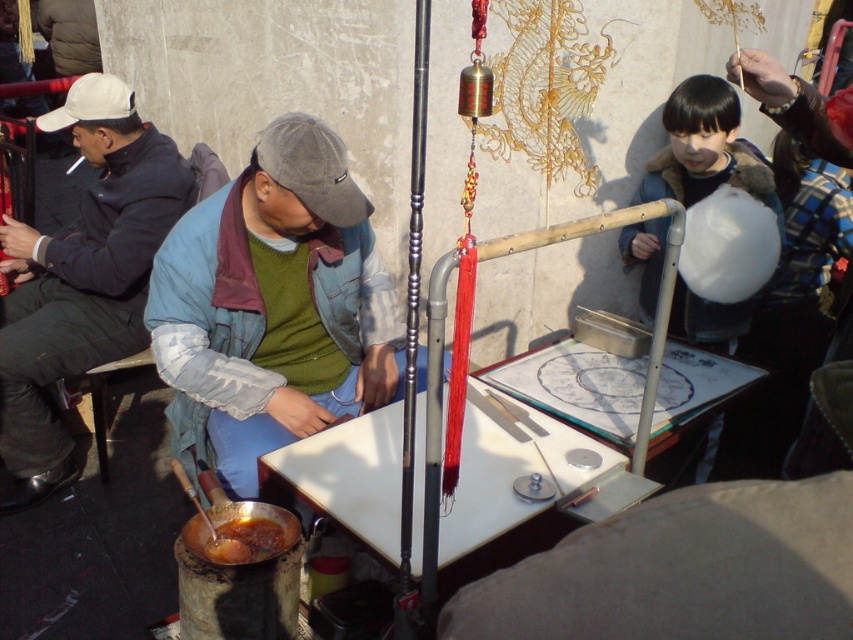
Question: Estimate the real-world distances between objects in this image. Which object is farther from the green fabric jacket at center?

Choices:
 (A) dark blue jacket at left
 (B) white cotton candy at right
 (C) smooth beige cushion at lower right
 (D) shiny brown sauce at lower left

Answer: (C)

Question: Does white cotton candy at right appear on the right side of shiny brown sauce at lower left?

Choices:
 (A) no
 (B) yes

Answer: (B)

Question: Considering the real-world distances, which object is closest to the smooth beige cushion at lower right?

Choices:
 (A) shiny brown sauce at lower left
 (B) dark blue jacket at left
 (C) green fabric jacket at center
 (D) white cotton candy at right

Answer: (A)

Question: Does dark blue jacket at left come in front of shiny brown sauce at lower left?

Choices:
 (A) no
 (B) yes

Answer: (A)

Question: Which is nearer to the green fabric jacket at center?

Choices:
 (A) dark blue jacket at left
 (B) smooth beige cushion at lower right
 (C) shiny brown sauce at lower left

Answer: (C)

Question: Considering the relative positions of green fabric jacket at center and shiny brown sauce at lower left in the image provided, where is green fabric jacket at center located with respect to shiny brown sauce at lower left?

Choices:
 (A) right
 (B) left

Answer: (A)